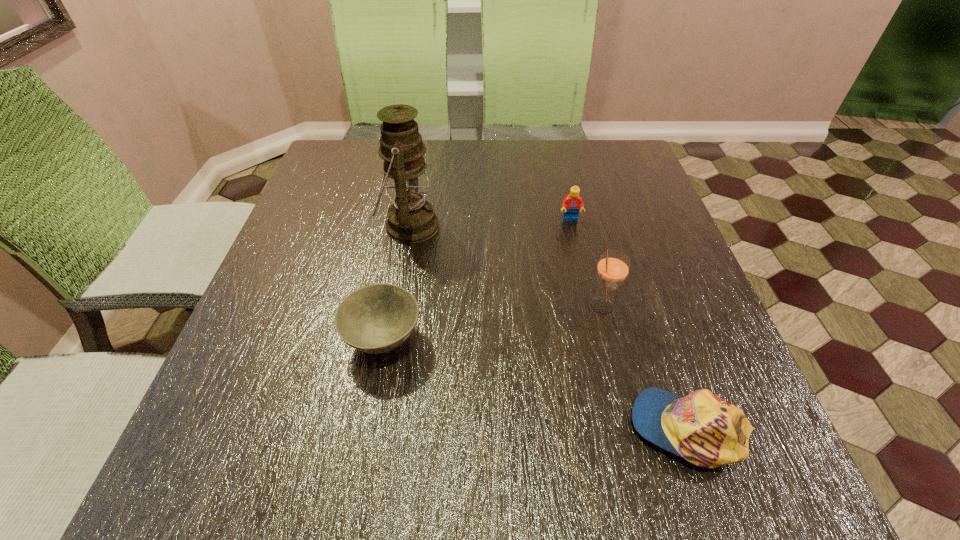
You are a GUI agent. You are given a task and a screenshot of the screen. Output one action in this format:
    pyautogui.click(x=<x>, y=<y>)
    Task: Click on the unoccupied position between the tallest object and the straw
    The height and width of the screenshot is (540, 960).
    Given the screenshot: What is the action you would take?
    pyautogui.click(x=505, y=267)

The height and width of the screenshot is (540, 960). I want to click on free area in between the nearest object and the bowl, so click(536, 384).

Image resolution: width=960 pixels, height=540 pixels. In order to click on free spot between the Lego and the tallest object in this screenshot , I will do `click(490, 222)`.

At what (x,y) coordinates should I click in order to perform the action: click on free area in between the Lego and the cap. Please return your answer as a coordinate pair (x, y). This screenshot has height=540, width=960. Looking at the image, I should click on (629, 323).

The width and height of the screenshot is (960, 540). Identify the location of free spot between the Lego and the tallest object. (490, 222).

I want to click on unoccupied area between the fourth shortest object and the oil lamp, so click(505, 267).

What are the coordinates of `vacant space that's between the Lego and the cap` in the screenshot? It's located at (629, 323).

Locate an element on the screen. The width and height of the screenshot is (960, 540). vacant space in between the straw and the Lego is located at coordinates (586, 263).

Locate an element on the screen. vacant space in between the bowl and the oil lamp is located at coordinates (396, 284).

The width and height of the screenshot is (960, 540). Identify the location of empty location between the fourth shortest object and the Lego. (586, 263).